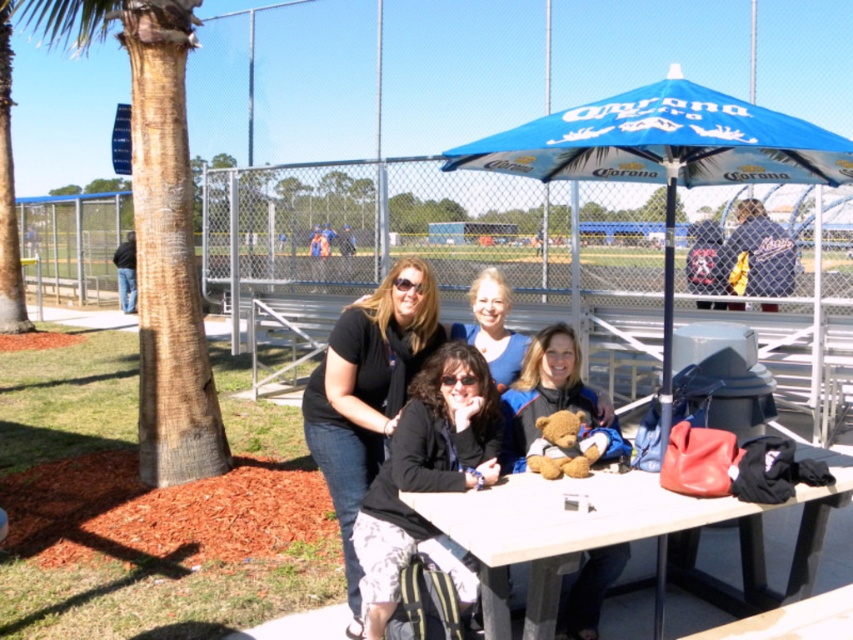
You are a photographer trying to capture a group photo of the women under the blue fabric umbrella at upper center. Considering the height of the umbrella and the black matte shirt at center, will the umbrella provide enough coverage to shade everyone from the sun?

Answer: The blue fabric umbrella at upper center is not as tall as the black matte shirt at center, so it may not provide sufficient coverage to shade everyone from the sun.

You are standing at the center of the table in the image. You want to walk to the point labeled as point (474, 468) and then to point (506, 298). Which point will require you to walk further away from the table?

Point (506, 298) is further away from the table than point (474, 468), so you will need to walk further away from the table to reach point (506, 298).